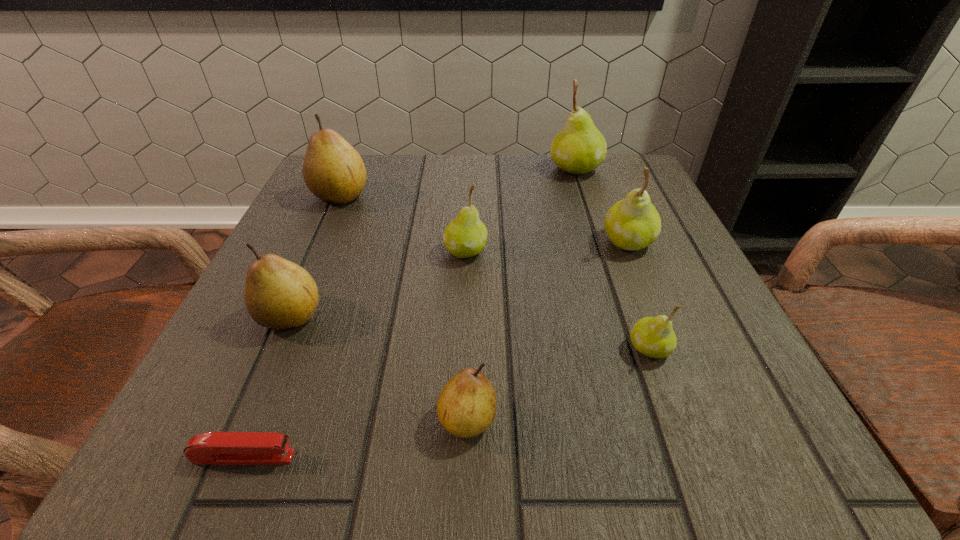
Identify the location of stapler that is at the near edge. This screenshot has height=540, width=960. (218, 448).

I want to click on stapler that is at the left edge, so click(218, 448).

The image size is (960, 540). I want to click on object located in the far left corner section of the desktop, so click(333, 170).

Locate an element on the screen. object that is at the near left corner is located at coordinates (218, 448).

Image resolution: width=960 pixels, height=540 pixels. Identify the location of object located in the far right corner section of the desktop. point(580,147).

Identify the location of free spot at the far edge of the desktop. Image resolution: width=960 pixels, height=540 pixels. (418, 169).

The image size is (960, 540). In the image, there is a desktop. In order to click on vacant region at the near edge in this screenshot , I will do `click(301, 455)`.

At what (x,y) coordinates should I click in order to perform the action: click on vacant space at the left edge of the desktop. Please return your answer as a coordinate pair (x, y). The image size is (960, 540). Looking at the image, I should click on (284, 248).

Image resolution: width=960 pixels, height=540 pixels. In the image, there is a desktop. What are the coordinates of `vacant space at the right edge` in the screenshot? It's located at (620, 285).

This screenshot has width=960, height=540. Find the location of `vacant region at the near left corner`. vacant region at the near left corner is located at coordinates (182, 405).